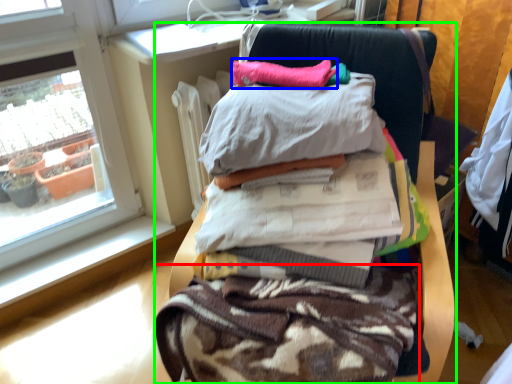
Question: Estimate the real-world distances between objects in this image. Which object is farther from fabric (highlighted by a red box), pillow (highlighted by a blue box) or furniture (highlighted by a green box)?

Choices:
 (A) pillow
 (B) furniture

Answer: (A)